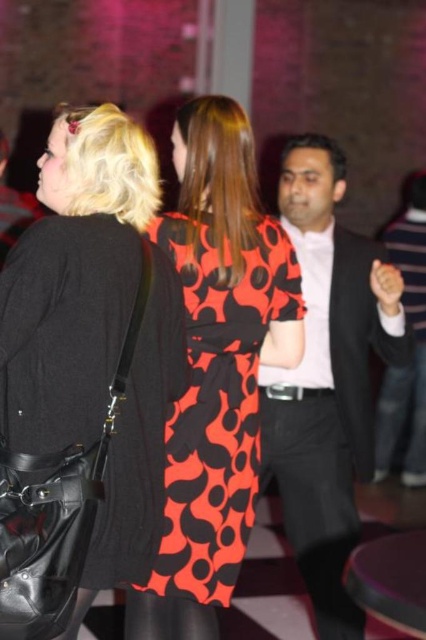
Between point (313, 234) and point (294, 518), which one is positioned behind?

The point (313, 234) is more distant.

Is point (290, 410) positioned before point (342, 541)?

No, (290, 410) is further to viewer.

Between point (319, 172) and point (322, 620), which one is positioned in front?

Positioned in front is point (322, 620).

I want to click on matte black suit at center, so click(x=327, y=378).

Between matte black dress at center and matte black suit at center, which one appears on the left side from the viewer's perspective?

Positioned to the left is matte black dress at center.

Is matte black dress at center smaller than matte black suit at center?

Correct, matte black dress at center occupies less space than matte black suit at center.

Who is more forward, (103, 193) or (264, 451)?

Positioned in front is point (103, 193).

Where is `matte black dress at center`? Image resolution: width=426 pixels, height=640 pixels. matte black dress at center is located at coordinates (74, 280).

What do you see at coordinates (74, 280) in the screenshot?
I see `matte black dress at center` at bounding box center [74, 280].

Which is behind, point (121, 241) or point (311, 416)?

The point (311, 416) is behind.

Which is behind, point (103, 378) or point (290, 532)?

Point (290, 532)

Where is `matte black dress at center`? Image resolution: width=426 pixels, height=640 pixels. matte black dress at center is located at coordinates (74, 280).